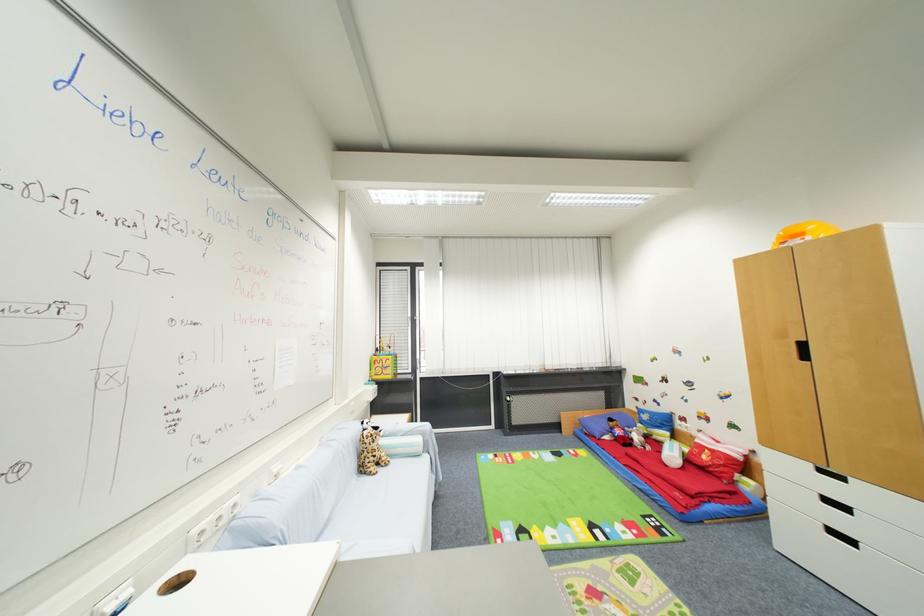
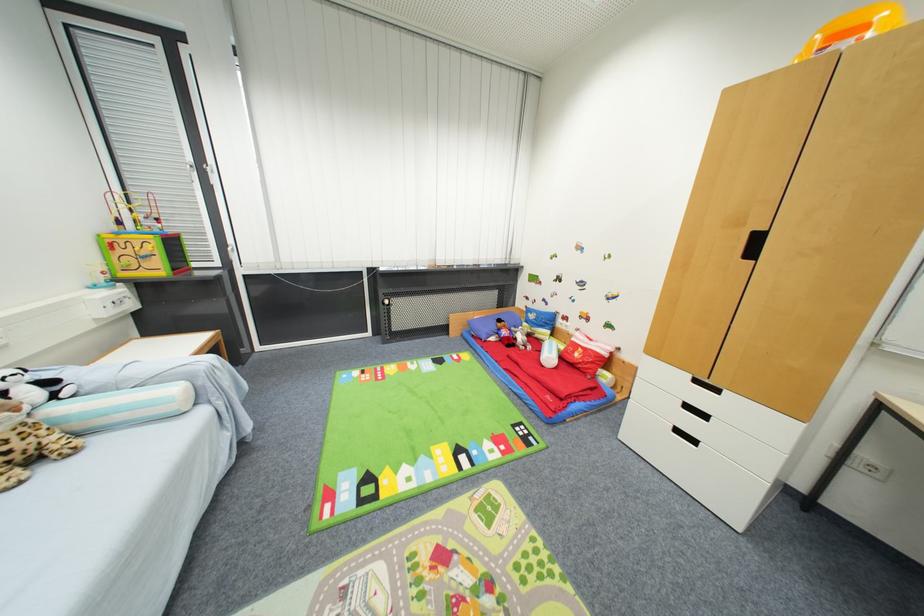
Where in the second image is the point corresponding to pixel 613 532 from the first image?

(479, 455)